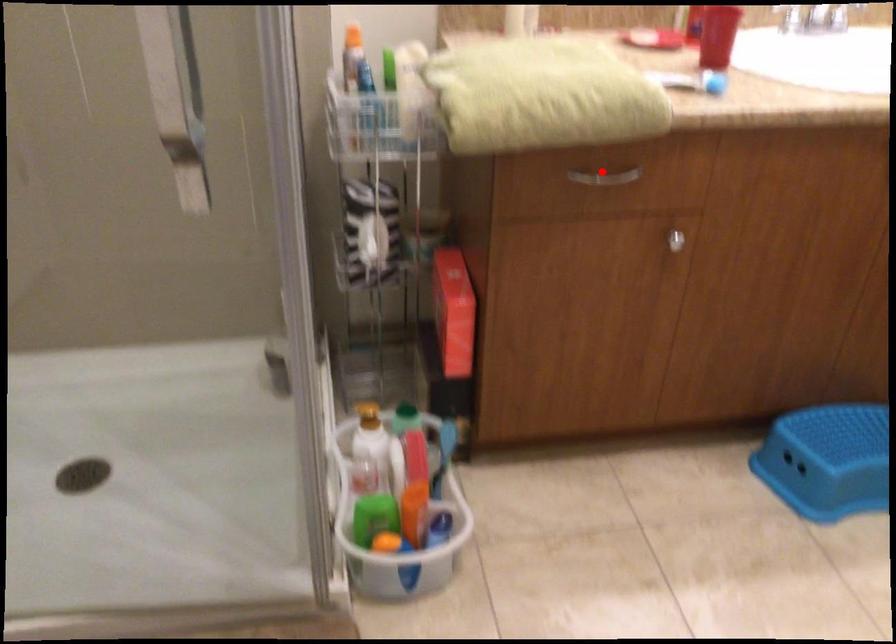
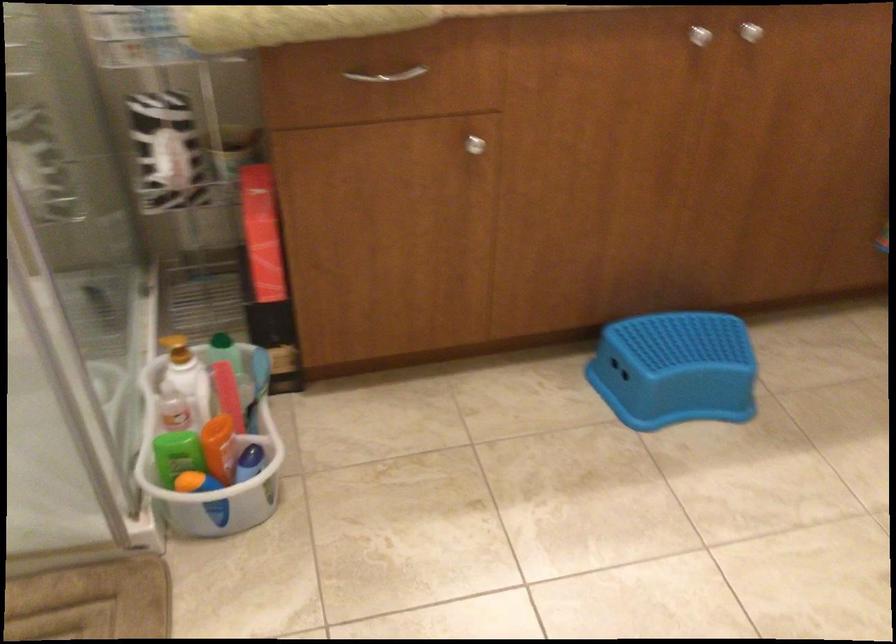
The point at the highlighted location is marked in the first image. Where is the corresponding point in the second image?

(386, 75)